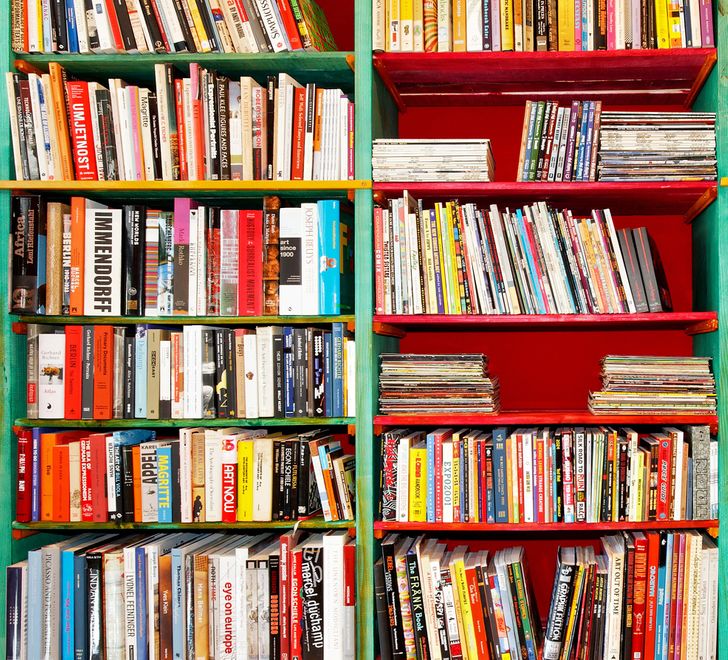
The image size is (728, 660). Find the location of `wooden shelves`. wooden shelves is located at coordinates (182, 57), (182, 185), (178, 315), (181, 420), (182, 527), (545, 521), (547, 418), (542, 317), (542, 181), (555, 57).